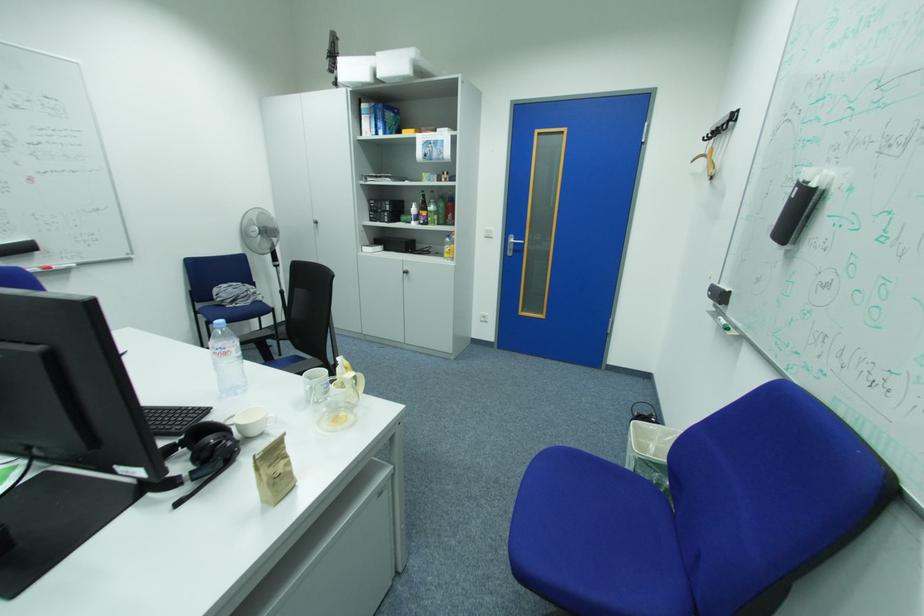
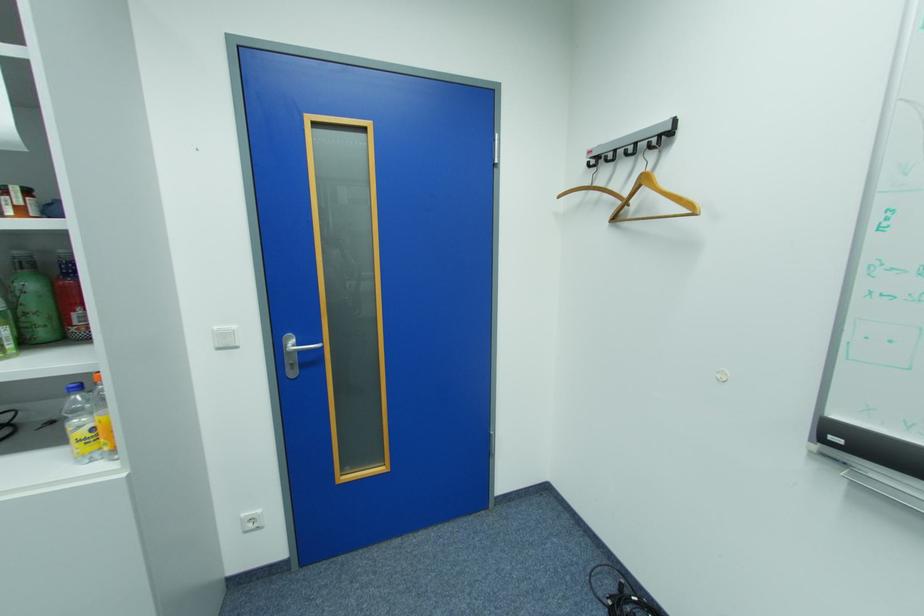
Where in the second image is the point corresponding to the point at 456,249 from the first image?

(89, 427)